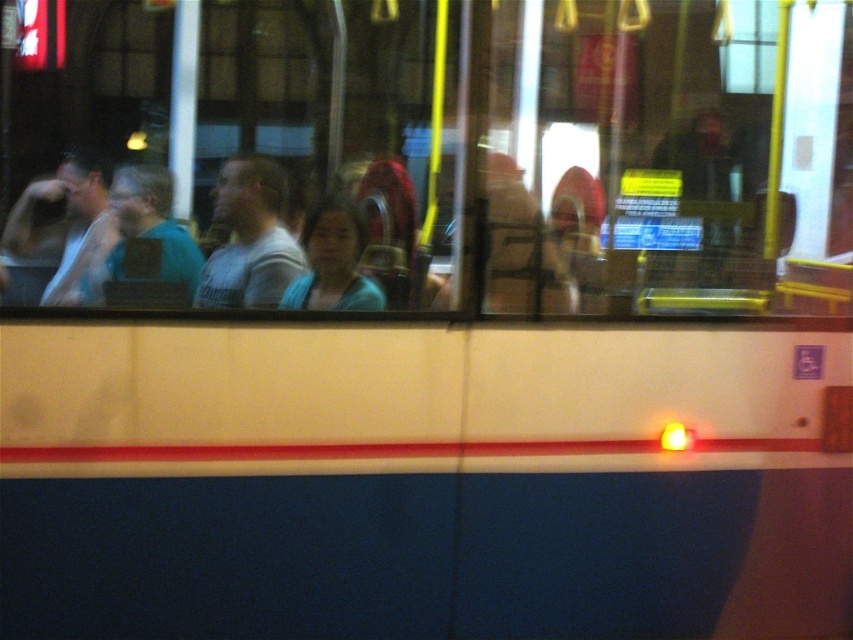
You are a passenger on a nighttime bus ride and notice two people sitting in front of you. One is wearing a light blue shirt at center and the other a white tank top at left. Which person is sitting closer to the front of the bus?

The light blue shirt at center is positioned under the white tank top at left, indicating that the white tank top at left is sitting closer to the front of the bus.

You are standing at the point marked as point (157, 264) inside the public transport vehicle. The driver tells you to move to the back of the vehicle. If the back of the vehicle is 10 feet away from the camera, can you reach the back by walking 9 feet from your current position?

The distance between point (157, 264) and the camera is 8.96 feet. Since the back of the vehicle is 10 feet away from the camera, you are already 8.96 feet away from the camera towards the back. Walking an additional 9 feet would exceed the required distance to reach the back. Therefore, you can reach the back by walking 9 feet from your current position.

You are a passenger on a bus at night. You notice two people wearing shirts of different colors. The person in the matte green shirt at left and the person in the matte blue shirt at center. Which shirt appears bigger in size?

The matte green shirt at left appears larger in size than the matte blue shirt at center.